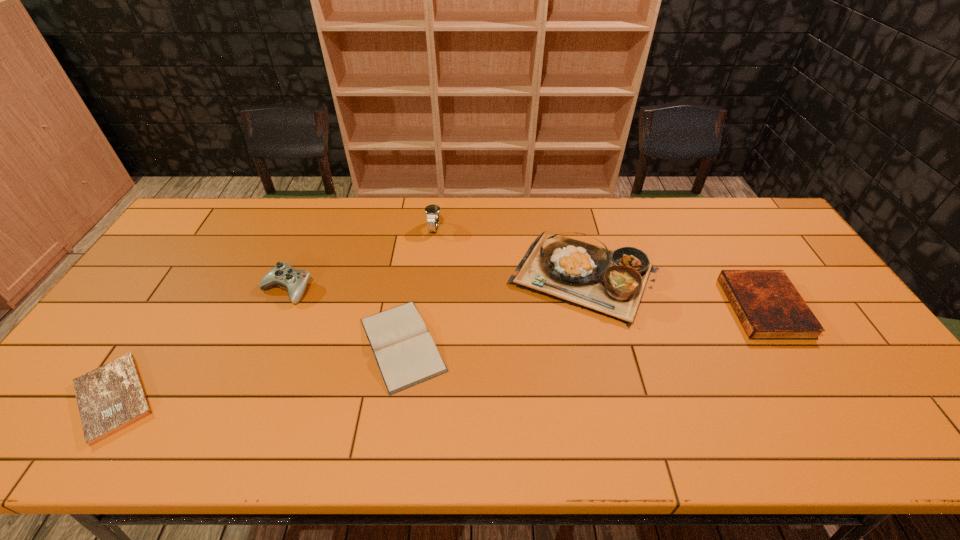
Where is `object located in the near edge section of the desktop`? The width and height of the screenshot is (960, 540). object located in the near edge section of the desktop is located at coordinates [x=111, y=397].

I want to click on object present at the left edge, so click(111, 397).

Identify the location of object situated at the right edge. (769, 307).

Identify the location of object at the near left corner. (111, 397).

In the image, there is a desktop. In order to click on vacant space at the far edge in this screenshot , I will do `click(566, 231)`.

The width and height of the screenshot is (960, 540). In order to click on vacant region at the near edge of the desktop in this screenshot , I will do `click(383, 444)`.

In the image, there is a desktop. In order to click on vacant space at the right edge in this screenshot , I will do `click(840, 398)`.

Locate an element on the screen. The width and height of the screenshot is (960, 540). free space at the near right corner of the desktop is located at coordinates (883, 441).

The image size is (960, 540). What are the coordinates of `blank region between the fifth object from left to right and the second shortest Bible` in the screenshot? It's located at (493, 310).

The height and width of the screenshot is (540, 960). I want to click on blank region between the shortest object and the second shortest object, so click(x=258, y=370).